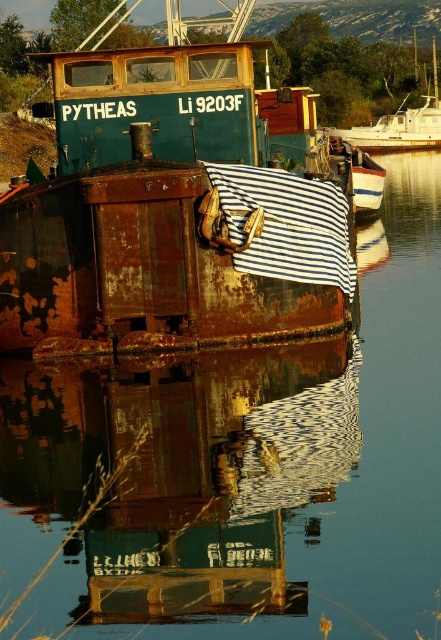
Question: Among these objects, which one is farthest from the camera?

Choices:
 (A) rusty metal boat at lower center
 (B) white glossy boat at right

Answer: (B)

Question: Is rusty metal boat at center wider than white glossy boat at right?

Choices:
 (A) yes
 (B) no

Answer: (B)

Question: Which of these objects is positioned closest to the rusty metal boat at center?

Choices:
 (A) white glossy boat at right
 (B) rusty metal boat at lower center

Answer: (B)

Question: Is rusty metal boat at lower center bigger than white glossy boat at right?

Choices:
 (A) yes
 (B) no

Answer: (B)

Question: Among these objects, which one is farthest from the camera?

Choices:
 (A) rusty metal boat at center
 (B) rusty metal boat at lower center

Answer: (A)

Question: Can you confirm if rusty metal boat at lower center is wider than rusty metal boat at center?

Choices:
 (A) no
 (B) yes

Answer: (A)